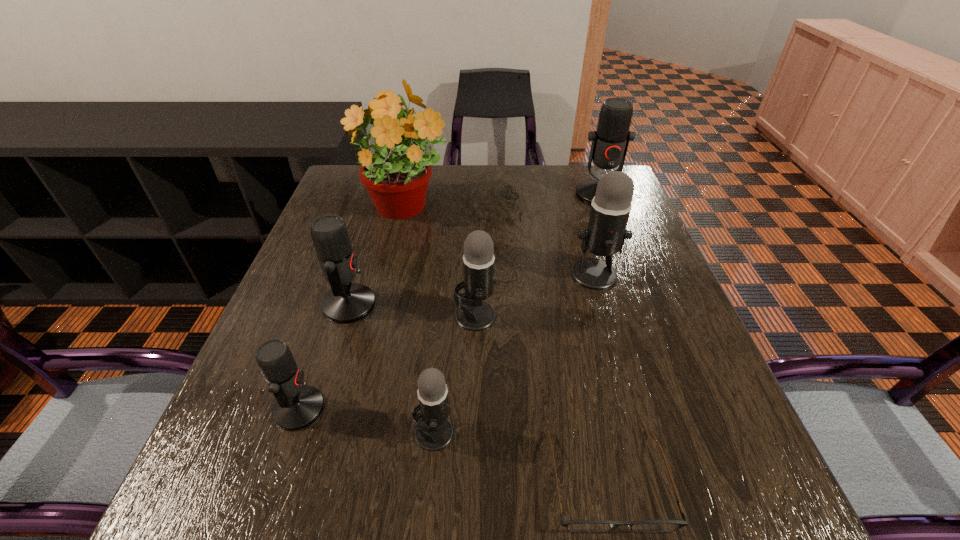
Find the location of `object present at the near edge`. object present at the near edge is located at coordinates point(577,526).

This screenshot has height=540, width=960. What are the coordinates of `flowerpot present at the left edge` in the screenshot? It's located at (397, 182).

This screenshot has width=960, height=540. What are the coordinates of `spectacles present at the right edge` in the screenshot? It's located at (577, 526).

Identify the location of object present at the far left corner. (397, 182).

The height and width of the screenshot is (540, 960). In order to click on object that is at the far right corner in this screenshot , I will do [610, 141].

Identify the location of object that is at the near right corner. (577, 526).

The height and width of the screenshot is (540, 960). Identify the location of vacant space at the far edge of the desktop. (500, 165).

Locate an element on the screen. The image size is (960, 540). vacant region at the near edge of the desktop is located at coordinates pos(321,520).

The image size is (960, 540). In the image, there is a desktop. Find the location of `blank space at the left edge`. blank space at the left edge is located at coordinates (368, 220).

You are a GUI agent. You are given a task and a screenshot of the screen. Output one action in this format:
    pyautogui.click(x=<x>, y=<y>)
    Task: Click on the vacant area at the right edge of the desktop
    This screenshot has height=540, width=960.
    Given the screenshot: What is the action you would take?
    (x=642, y=297)